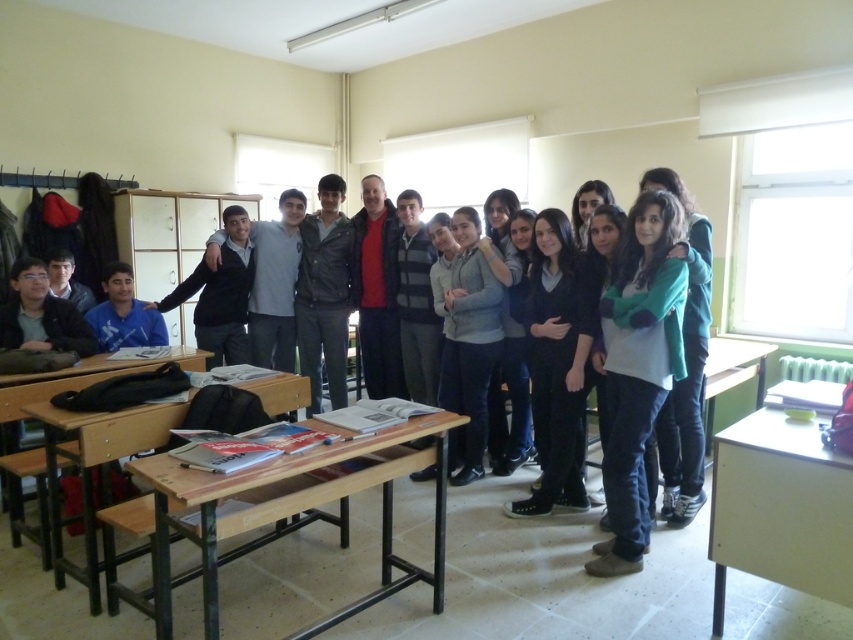
You are organizing a classroom activity and need to seat 5 students. You have access to the wooden table at center and the wooden desk at right. Which object can accommodate more students comfortably?

The wooden table at center can accommodate more students comfortably since it has a larger size compared to the wooden desk at right.

You are a student who needs to place a tall textbook on a surface. Given that the light wood table at right is shorter than the wooden desk at lower left, which surface would you choose to ensure the textbook doesn

The wooden desk at lower left is taller than the light wood table at right, so you should place the tall textbook on the wooden desk at lower left to ensure it fits properly.

You are organizing a classroom event and need to place a 1.2 meter wide banner between the wooden table at center and the light wood table at right. Can the banner fit between them based on their widths?

The wooden table at center is wider than the light wood table at right. However, the banner requires 1.2 meters of space. Since the exact widths aren not provided, we can only compare their relative sizes. If the combined width of both tables is less than 1.2 meters, the banner might fit, but without specific measurements, it is uncertain.